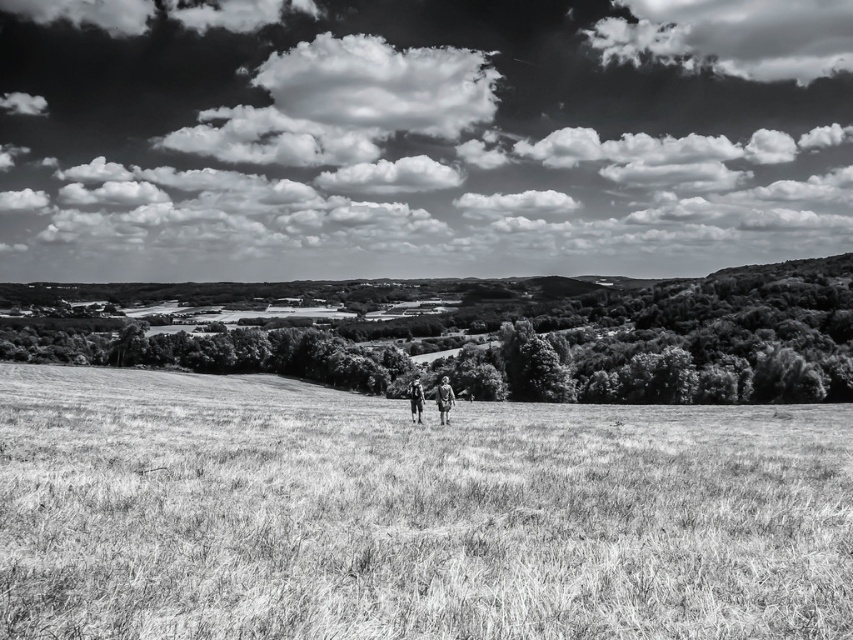
You are a photographer standing at the edge of the dry grassland in the scene. You want to take a photo that includes both the wooden figure at center and the camouflage fabric person at center. Given that your camera has a maximum focus range of 12 meters, will you be able to capture both subjects in focus at the same time?

The distance between the wooden figure at center and the camouflage fabric person at center is 13.71 meters. Since your camera can only focus up to 12 meters, you won not be able to capture both subjects in focus simultaneously.

You are a photographer planning to take a picture of the grassy at center and camouflage fabric person at center in the scene. Based on their sizes, which object would appear larger in the photo?

The grassy at center would appear larger in the photo because it is wider than the camouflage fabric person at center.